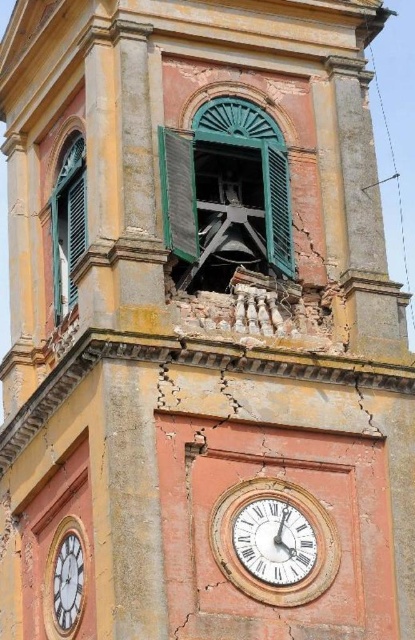
Between white wooden clock at center and green matte shutter at center, which one is positioned lower?

white wooden clock at center

Can you confirm if white wooden clock at center is wider than green matte shutter at center?

Yes.

Is point (258, 554) positioned in front of point (183, 228)?

Yes, it is in front of point (183, 228).

At what (x,y) coordinates should I click in order to perform the action: click on white wooden clock at center. Please return your answer as a coordinate pair (x, y). The height and width of the screenshot is (640, 415). Looking at the image, I should click on (273, 541).

From the picture: Who is more forward, (282, 541) or (53, 557)?

Positioned in front is point (282, 541).

Is white wooden clock at center further to camera compared to white matte clock at lower left?

No, white wooden clock at center is in front of white matte clock at lower left.

Which is behind, point (304, 522) or point (65, 595)?

Positioned behind is point (65, 595).

The image size is (415, 640). I want to click on white wooden clock at center, so click(x=273, y=541).

Who is more forward, (75, 524) or (180, 148)?

Positioned in front is point (75, 524).

You are a GUI agent. You are given a task and a screenshot of the screen. Output one action in this format:
    pyautogui.click(x=<x>, y=<y>)
    Task: Click on the white matte clock at lower left
    
    Given the screenshot: What is the action you would take?
    pyautogui.click(x=65, y=579)

The height and width of the screenshot is (640, 415). I want to click on white matte clock at lower left, so click(x=65, y=579).